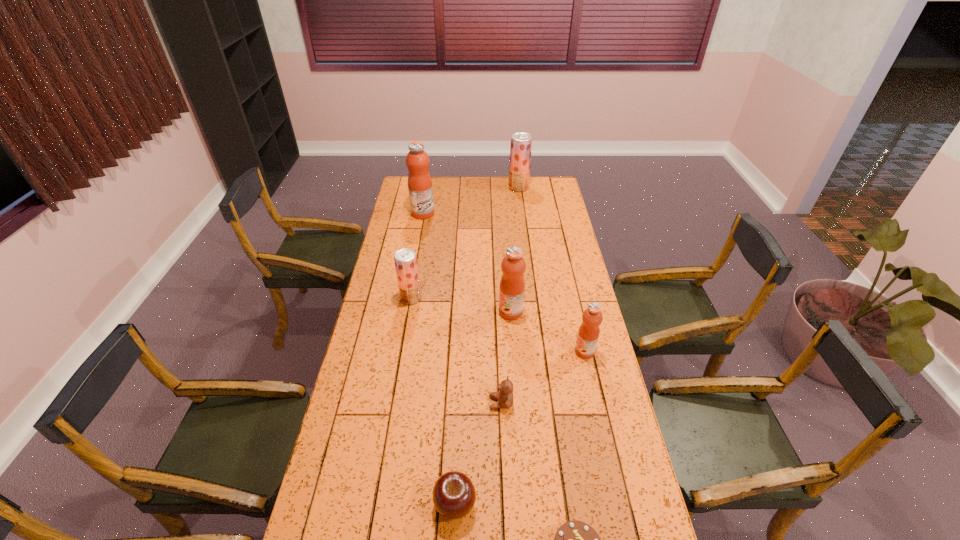
You are a GUI agent. You are given a task and a screenshot of the screen. Output one action in this format:
    pyautogui.click(x=<x>, y=<y>)
    Task: Click on the vacant region located 0.340m on the front label of the nearest fruit juice
    
    Given the screenshot: What is the action you would take?
    pyautogui.click(x=480, y=352)

Identify the location of free location located on the front label of the nearest fruit juice. Image resolution: width=960 pixels, height=540 pixels. (511, 352).

Find the location of a particular element. Image resolution: width=960 pixels, height=540 pixels. vacant position located on the front label of the nearest fruit juice is located at coordinates (494, 352).

Find the location of a particular element. vacant space situated on the face of the sixth farthest object is located at coordinates (452, 403).

Locate an element on the screen. The height and width of the screenshot is (540, 960). free space located on the face of the sixth farthest object is located at coordinates (465, 403).

At what (x,y) coordinates should I click in order to perform the action: click on vacant space located 0.330m on the face of the sixth farthest object. Please return your answer as a coordinate pair (x, y). Image resolution: width=960 pixels, height=540 pixels. Looking at the image, I should click on (387, 403).

Identify the location of free space located on the left of the seventh farthest object. (390, 504).

Identify the location of object that is at the far edge. (521, 143).

The height and width of the screenshot is (540, 960). Identify the location of object that is at the right edge. (588, 333).

In the image, there is a desktop. Identify the location of vacant space at the far edge. The image size is (960, 540). click(524, 194).